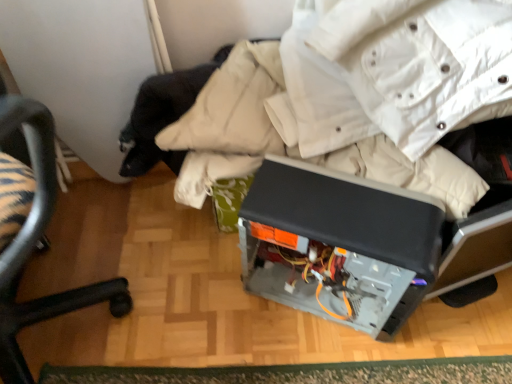
At what (x,y) coordinates should I click in order to perform the action: click on unoccupied area in front of satin black computer case at center. Please return your answer as a coordinate pair (x, y). Looking at the image, I should click on (330, 357).